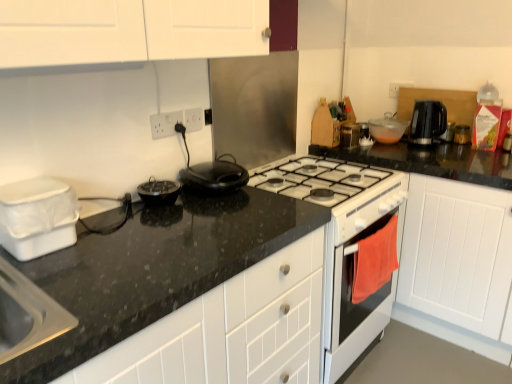
Question: Is black plastic kettle at upper right, which is the second kitchen appliance from right to left, wider than black granite countertop at center?

Choices:
 (A) yes
 (B) no

Answer: (B)

Question: Considering the relative positions of black plastic kettle at upper right, which is the second kitchen appliance from right to left, and black granite countertop at center in the image provided, is black plastic kettle at upper right, which is the second kitchen appliance from right to left, behind black granite countertop at center?

Choices:
 (A) no
 (B) yes

Answer: (B)

Question: Is black plastic kettle at upper right, the 6th kitchen appliance when ordered from left to right, bigger than black granite countertop at center?

Choices:
 (A) no
 (B) yes

Answer: (A)

Question: Is black plastic kettle at upper right, which is the second kitchen appliance from right to left, aimed at black granite countertop at center?

Choices:
 (A) yes
 (B) no

Answer: (A)

Question: Is the position of black plastic kettle at upper right, the 4th kitchen appliance from the back, less distant than that of black granite countertop at center?

Choices:
 (A) no
 (B) yes

Answer: (A)

Question: From a real-world perspective, relative to white plastic container at left, which appears as the first kitchen appliance when viewed from the left, is black plastic kettle at upper right, which is the first appliance in top-to-bottom order, vertically above or below?

Choices:
 (A) above
 (B) below

Answer: (B)

Question: In the image, is black plastic kettle at upper right, which is the first appliance in top-to-bottom order, positioned in front of or behind white plastic container at left, which appears as the first kitchen appliance when viewed from the left?

Choices:
 (A) behind
 (B) front

Answer: (A)

Question: From the image's perspective, is black plastic kettle at upper right, the 2th appliance ordered from the bottom, positioned above or below white plastic container at left, which appears as the first kitchen appliance when viewed from the left?

Choices:
 (A) above
 (B) below

Answer: (A)

Question: Considering the positions of black plastic kettle at upper right, which is the first appliance in top-to-bottom order, and white plastic container at left, placed as the first kitchen appliance when sorted from front to back, in the image, is black plastic kettle at upper right, which is the first appliance in top-to-bottom order, taller or shorter than white plastic container at left, placed as the first kitchen appliance when sorted from front to back,?

Choices:
 (A) tall
 (B) short

Answer: (B)

Question: Considering the positions of point (353, 132) and point (167, 135), is point (353, 132) closer or farther from the camera than point (167, 135)?

Choices:
 (A) farther
 (B) closer

Answer: (A)

Question: Would you say metallic silver spice rack at upper right, arranged as the 4th kitchen appliance when viewed from the right, is to the left or to the right of white plastic electric outlet at upper center, which is the 1th electric outlet from left to right, in the picture?

Choices:
 (A) right
 (B) left

Answer: (A)

Question: Considering the positions of metallic silver spice rack at upper right, marked as the 4th kitchen appliance in a left-to-right arrangement, and white plastic electric outlet at upper center, which is the 1th electric outlet from left to right, in the image, is metallic silver spice rack at upper right, marked as the 4th kitchen appliance in a left-to-right arrangement, wider or thinner than white plastic electric outlet at upper center, which is the 1th electric outlet from left to right,?

Choices:
 (A) wide
 (B) thin

Answer: (A)

Question: From a real-world perspective, is metallic silver spice rack at upper right, marked as the 3th kitchen appliance in a back-to-front arrangement, above or below white plastic electric outlet at upper center, which is the 2th electric outlet from right to left?

Choices:
 (A) above
 (B) below

Answer: (B)

Question: In terms of width, does white plastic container at left, placed as the first kitchen appliance when sorted from front to back, look wider or thinner when compared to black granite countertop at center?

Choices:
 (A) thin
 (B) wide

Answer: (A)

Question: Do you think white plastic container at left, the 7th kitchen appliance from the back, is within black granite countertop at center, or outside of it?

Choices:
 (A) inside
 (B) outside

Answer: (B)